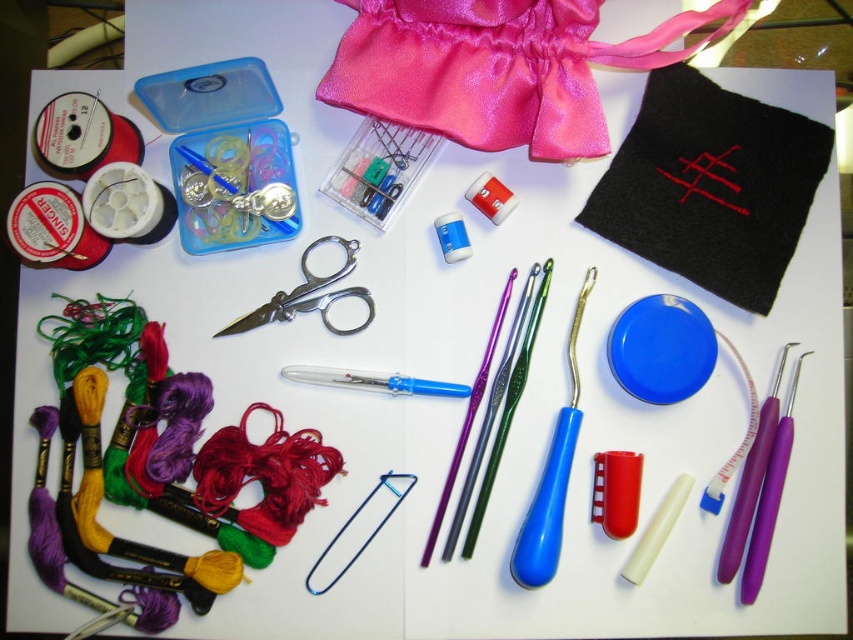
What is located at the coordinates point (498, 68) in the image?

The point (498, 68) indicates the location of the shiny pink fabric at upper center in the image.

You are organizing a craft table and need to place a new item between the shiny pink fabric at upper center and the metallic silver crochet hook at center. Based on their positions, which side of the crochet hook should you place the new item?

The shiny pink fabric at upper center is to the right of the metallic silver crochet hook at center, so you should place the new item to the left of the crochet hook to maintain the arrangement.

You are organizing a craft kit and need to know the relative sizes of the items. Which object is taller between the shiny pink fabric at upper center and the metallic scissors at center?

The shiny pink fabric at upper center is much taller than the metallic scissors at center.